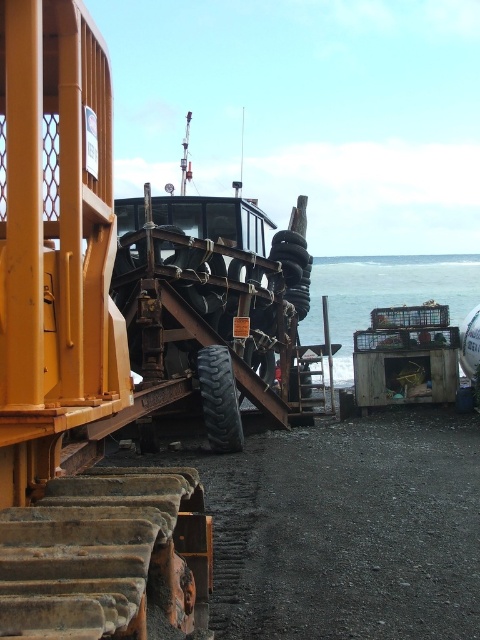
Question: Is blue water at lower right positioned before black rubber tire at center?

Choices:
 (A) yes
 (B) no

Answer: (B)

Question: Which point is closer to the camera?

Choices:
 (A) blue water at lower right
 (B) black rubber tire at center

Answer: (B)

Question: Which of the following is the farthest from the observer?

Choices:
 (A) black rubber tire at center
 (B) blue water at lower right

Answer: (B)

Question: Is blue water at lower right above black rubber tire at center?

Choices:
 (A) no
 (B) yes

Answer: (B)

Question: Which point is farther to the camera?

Choices:
 (A) blue water at lower right
 (B) black rubber tire at center

Answer: (A)

Question: Is the position of blue water at lower right more distant than that of black rubber tire at center?

Choices:
 (A) no
 (B) yes

Answer: (B)